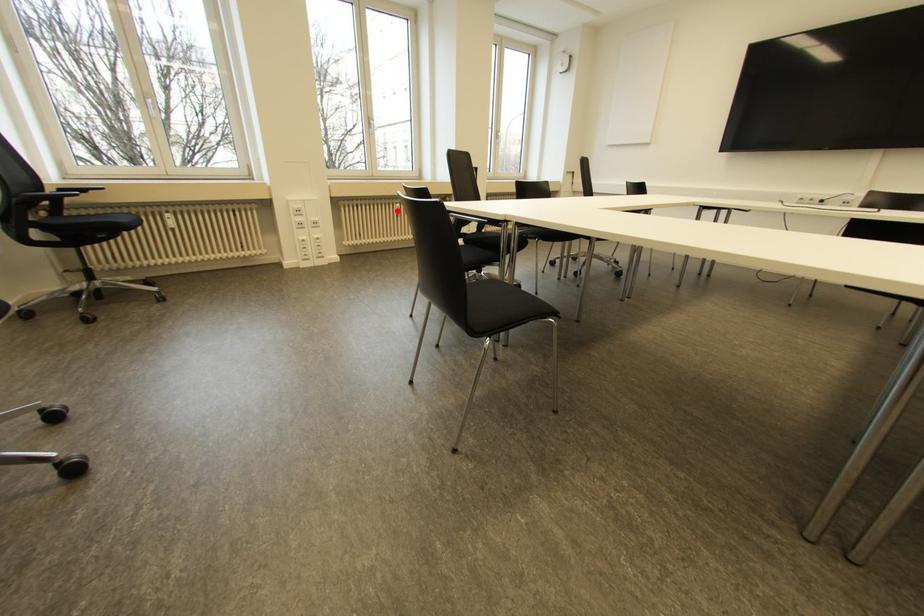
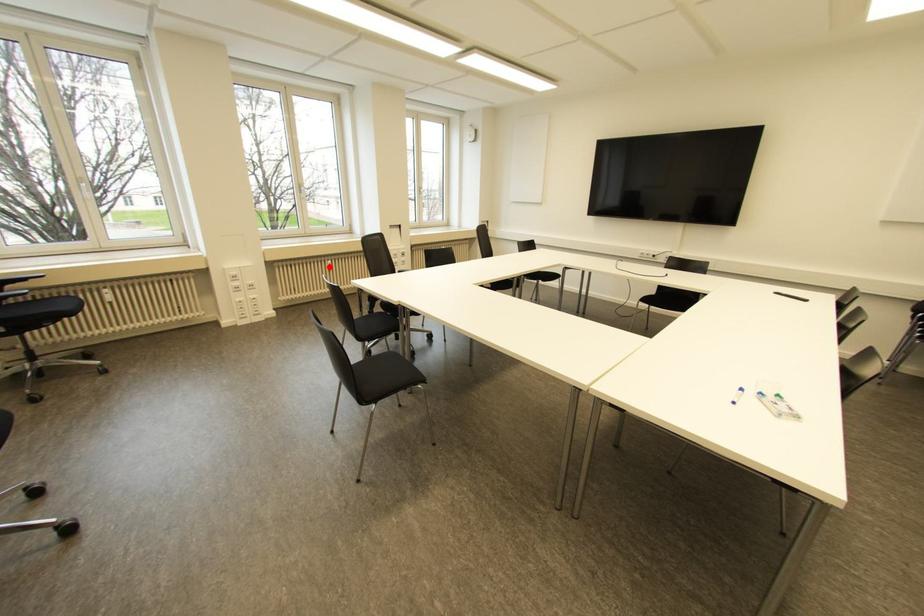
I am providing you with two images of the same scene from different viewpoints. A red point is marked on the first image and another point is marked on the second image. Is the marked point in image1 the same physical position as the marked point in image2?

Yes